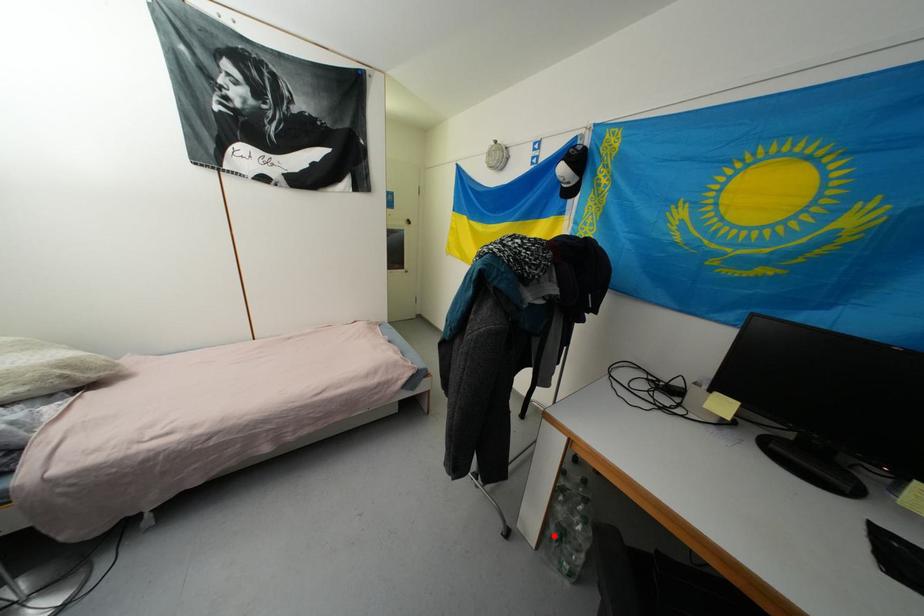
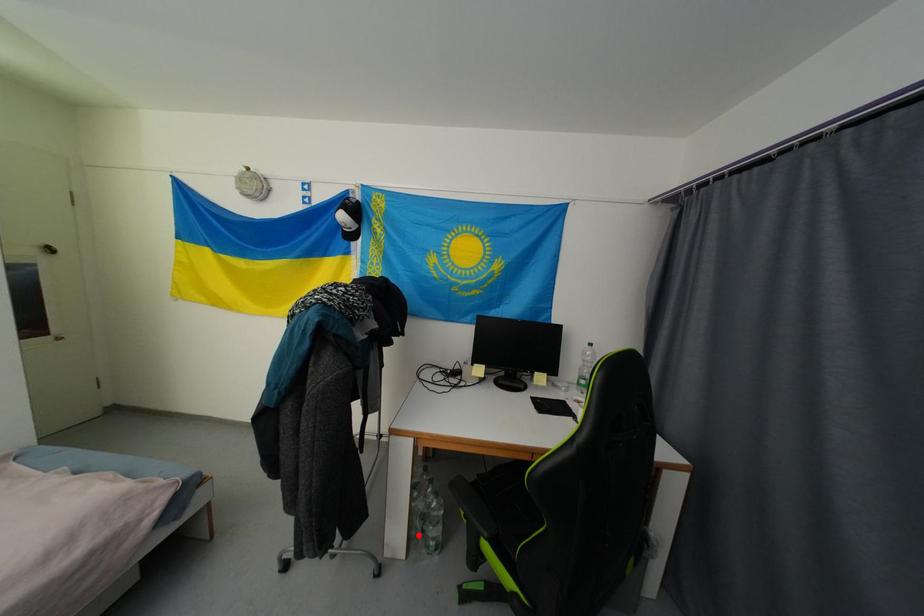
I am providing you with two images of the same scene from different viewpoints. A red point is marked on the first image and another point is marked on the second image. Does the point marked in image1 correspond to the same location as the one in image2?

Yes